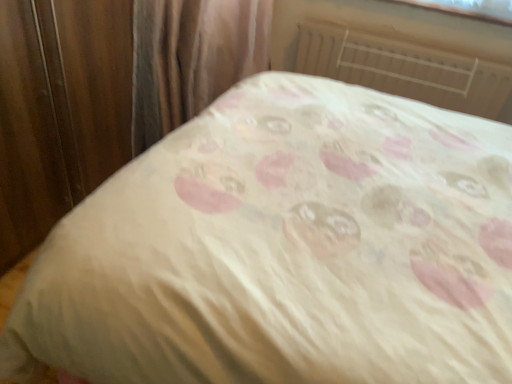
Where is `free space above white plastic radiator at upper center (from a real-world perspective)`? Image resolution: width=512 pixels, height=384 pixels. free space above white plastic radiator at upper center (from a real-world perspective) is located at coordinates (404, 38).